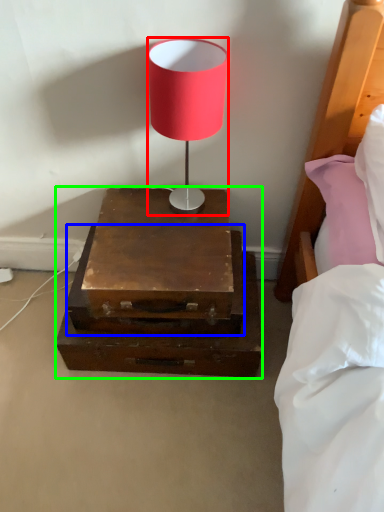
Question: Based on their relative distances, which object is nearer to lamp (highlighted by a red box)? Choose from drawer (highlighted by a blue box) and nightstand (highlighted by a green box).

Choices:
 (A) drawer
 (B) nightstand

Answer: (B)